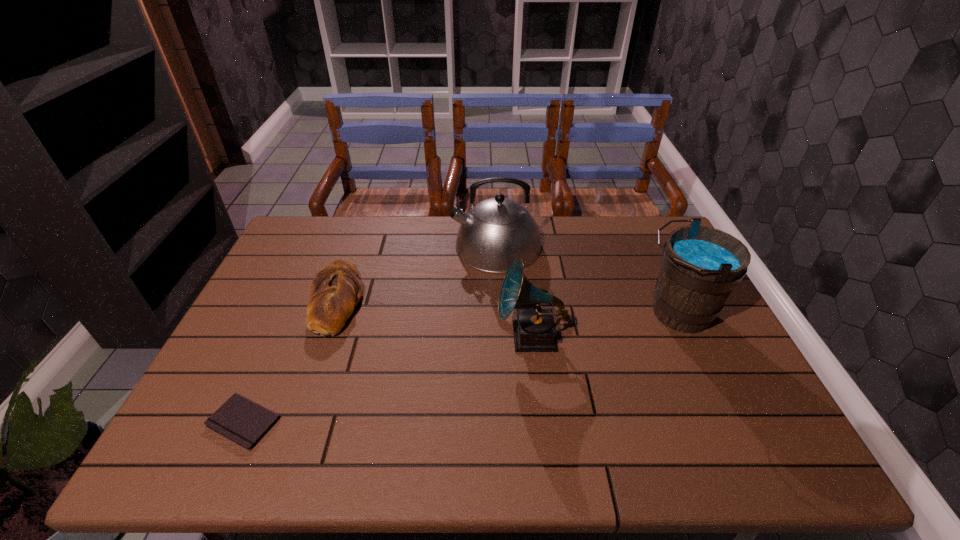
I want to click on object positioned at the right edge, so click(700, 266).

In order to click on object situated at the near left corner in this screenshot , I will do `click(244, 422)`.

The height and width of the screenshot is (540, 960). Find the location of `free space at the far edge of the desktop`. free space at the far edge of the desktop is located at coordinates (583, 221).

This screenshot has width=960, height=540. In the image, there is a desktop. Find the location of `vacant area at the near edge`. vacant area at the near edge is located at coordinates (322, 462).

Where is `free space at the left edge`? free space at the left edge is located at coordinates (238, 327).

I want to click on vacant space at the right edge, so click(723, 404).

At what (x,y) coordinates should I click in order to perform the action: click on free space that is in between the rightmost object and the phonograph_record. Please return your answer as a coordinate pair (x, y). Looking at the image, I should click on (604, 325).

Image resolution: width=960 pixels, height=540 pixels. I want to click on vacant area between the fourth tallest object and the checkbook, so click(x=290, y=360).

Locate an element on the screen. Image resolution: width=960 pixels, height=540 pixels. vacant space that's between the wine bucket and the checkbook is located at coordinates (461, 367).

I want to click on free space between the rightmost object and the kettle, so click(587, 279).